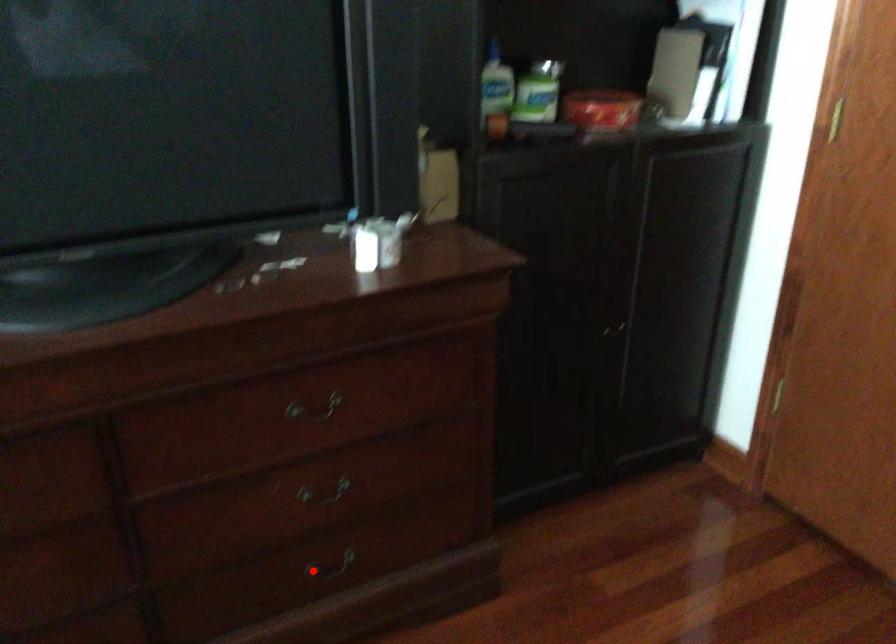
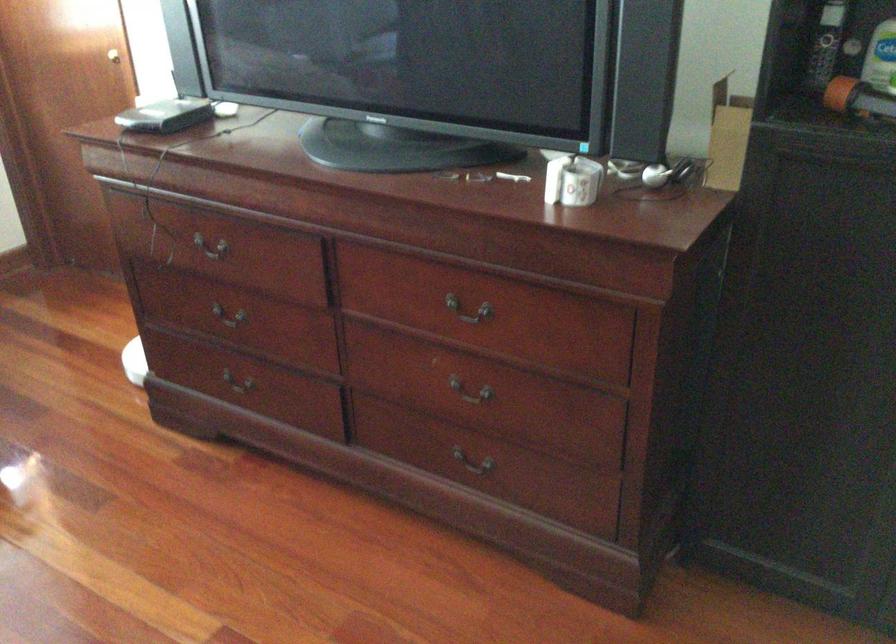
In the second image, find the point that corresponds to the highlighted location in the first image.

(471, 466)